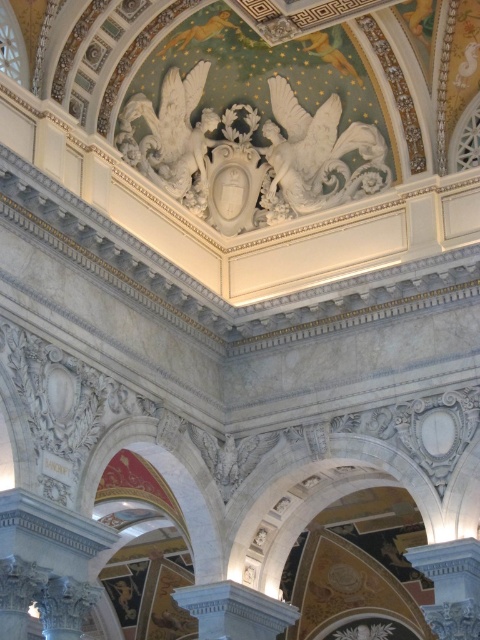
You are an architect designing a new building and want to ensure that the white marble eagle at upper center and the white marble column at center are proportionate. Which object should you make larger to maintain proper scale according to the existing design?

The white marble column at center should be made larger since the existing design shows that the white marble eagle at upper center has a smaller size compared to the white marble column at center.

You are an architect examining the ceiling design of a grand building. You notice the white marble eagle at upper center. Can you determine its exact position relative to the center of the ceiling?

The white marble eagle at upper center is located at point coordinates of 0.241 on the x axis and 0.665 on the y axis relative to the ceiling center.

You are an architect designing a replica of this space. You need to ensure the white marble column at lower right and the white marble column at center are proportionally accurate. Which column should you make smaller in your design?

The white marble column at lower right should be made smaller than the white marble column at center to maintain proportional accuracy.